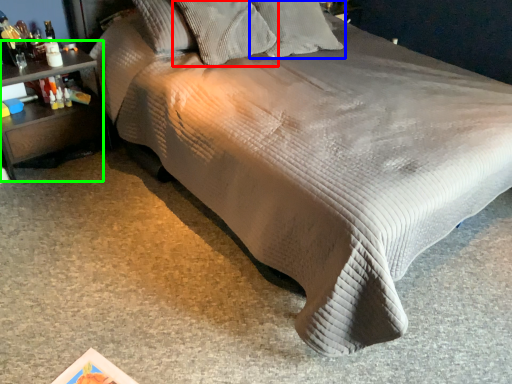
Question: Which object is positioned closest to pillow (highlighted by a red box)? Select from pillow (highlighted by a blue box) and nightstand (highlighted by a green box).

Choices:
 (A) pillow
 (B) nightstand

Answer: (A)